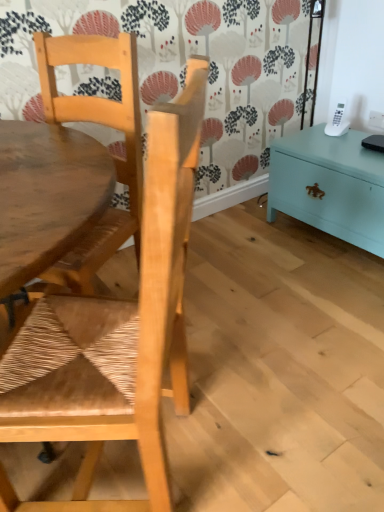
The height and width of the screenshot is (512, 384). What do you see at coordinates (330, 185) in the screenshot?
I see `teal painted wood chest at right` at bounding box center [330, 185].

You are a GUI agent. You are given a task and a screenshot of the screen. Output one action in this format:
    pyautogui.click(x=<x>, y=<y>)
    Task: Click on the natural wood chair at left, positioned as the 2th chair in top-to-bottom order
    Image resolution: width=384 pixels, height=512 pixels.
    Given the screenshot: What is the action you would take?
    pyautogui.click(x=114, y=333)

Is teal painted wood chest at right touching natural wood chair at left, the 1th chair ordered from the bottom?

No, teal painted wood chest at right is not making contact with natural wood chair at left, the 1th chair ordered from the bottom.

Which is more to the left, teal painted wood chest at right or natural wood chair at left, the 1th chair ordered from the bottom?

natural wood chair at left, the 1th chair ordered from the bottom, is more to the left.

From the image's perspective, is teal painted wood chest at right beneath natural wood chair at left, positioned as the 2th chair in top-to-bottom order?

No, from the image's perspective, teal painted wood chest at right is not below natural wood chair at left, positioned as the 2th chair in top-to-bottom order.

Is teal painted wood chest at right taller or shorter than natural wood chair at left, the 1th chair ordered from the bottom?

teal painted wood chest at right is shorter than natural wood chair at left, the 1th chair ordered from the bottom.

How many degrees apart are the facing directions of natural wood chair at left, the 1th chair ordered from the bottom, and white plastic power outlet at upper right?

The facing directions of natural wood chair at left, the 1th chair ordered from the bottom, and white plastic power outlet at upper right are 43 degrees apart.

Which object is positioned more to the right, natural wood chair at left, the 1th chair ordered from the bottom, or white plastic power outlet at upper right?

Positioned to the right is white plastic power outlet at upper right.

Locate an element on the screen. the 2nd chair in front of the white plastic power outlet at upper right is located at coordinates (114, 333).

Considering the sizes of objects natural wood chair at left, the 1th chair ordered from the bottom, and white plastic power outlet at upper right in the image provided, who is wider, natural wood chair at left, the 1th chair ordered from the bottom, or white plastic power outlet at upper right?

natural wood chair at left, the 1th chair ordered from the bottom.

Identify the location of chair that is the 1st object located in front of the teal painted wood chest at right. (112, 153).

Is point (373, 205) closer or farther from the camera than point (71, 56)?

Point (373, 205) appears to be farther away from the viewer than point (71, 56).

Can you tell me how much teal painted wood chest at right and natural wood chair at upper left, the second chair positioned from the bottom, differ in facing direction?

26 degrees separate the facing orientations of teal painted wood chest at right and natural wood chair at upper left, the second chair positioned from the bottom.

Considering the sizes of objects natural wood chair at upper left, the second chair positioned from the bottom, and natural wood chair at left, positioned as the 2th chair in top-to-bottom order, in the image provided, who is taller, natural wood chair at upper left, the second chair positioned from the bottom, or natural wood chair at left, positioned as the 2th chair in top-to-bottom order,?

natural wood chair at left, positioned as the 2th chair in top-to-bottom order.

Who is bigger, natural wood chair at upper left, the first chair when ordered from top to bottom, or natural wood chair at left, positioned as the 2th chair in top-to-bottom order?

natural wood chair at left, positioned as the 2th chair in top-to-bottom order, is bigger.

Is natural wood chair at upper left, the first chair when ordered from top to bottom, directly adjacent to natural wood chair at left, positioned as the 2th chair in top-to-bottom order?

There is a gap between natural wood chair at upper left, the first chair when ordered from top to bottom, and natural wood chair at left, positioned as the 2th chair in top-to-bottom order.

Would you say natural wood chair at upper left, the second chair positioned from the bottom, is to the left or to the right of natural wood chair at left, positioned as the 2th chair in top-to-bottom order, in the picture?

In the image, natural wood chair at upper left, the second chair positioned from the bottom, appears on the left side of natural wood chair at left, positioned as the 2th chair in top-to-bottom order.

Is white plastic power outlet at upper right not close to teal painted wood chest at right?

white plastic power outlet at upper right is actually quite close to teal painted wood chest at right.

How many degrees apart are the facing directions of white plastic power outlet at upper right and teal painted wood chest at right?

2.17 degrees.

Considering the points (372, 115) and (282, 140), which point is behind, point (372, 115) or point (282, 140)?

The point (372, 115) is farther from the camera.

Who is taller, white plastic power outlet at upper right or teal painted wood chest at right?

With more height is teal painted wood chest at right.

From the picture: Would you say natural wood chair at upper left, the second chair positioned from the bottom, is outside teal painted wood chest at right?

natural wood chair at upper left, the second chair positioned from the bottom, lies outside teal painted wood chest at right's area.

From a real-world perspective, is natural wood chair at upper left, the first chair when ordered from top to bottom, positioned under teal painted wood chest at right based on gravity?

No, from a real-world perspective, natural wood chair at upper left, the first chair when ordered from top to bottom, is not under teal painted wood chest at right.

How distant is natural wood chair at upper left, the first chair when ordered from top to bottom, from teal painted wood chest at right?

The distance of natural wood chair at upper left, the first chair when ordered from top to bottom, from teal painted wood chest at right is 97.93 centimeters.

Is teal painted wood chest at right facing away from white plastic power outlet at upper right?

Yes, teal painted wood chest at right is facing away from white plastic power outlet at upper right.

Does teal painted wood chest at right appear on the right side of white plastic power outlet at upper right?

No.

Is teal painted wood chest at right taller than white plastic power outlet at upper right?

Correct, teal painted wood chest at right is much taller as white plastic power outlet at upper right.

From the picture: Considering the positions of objects teal painted wood chest at right and white plastic power outlet at upper right in the image provided, who is in front, teal painted wood chest at right or white plastic power outlet at upper right?

teal painted wood chest at right is closer to the camera.

The height and width of the screenshot is (512, 384). In order to click on chair that is the 1st object above the teal painted wood chest at right (from a real-world perspective) in this screenshot , I will do `click(114, 333)`.

Which chair is the 2nd one when counting from the front of the white plastic power outlet at upper right? Please provide its 2D coordinates.

[(114, 333)]

From the image, which object appears to be farther from teal painted wood chest at right, white plastic power outlet at upper right or natural wood chair at upper left, the first chair when ordered from top to bottom?

Among the two, natural wood chair at upper left, the first chair when ordered from top to bottom, is located further to teal painted wood chest at right.

Based on the photo, looking at the image, which one is located further to natural wood chair at upper left, the second chair positioned from the bottom, natural wood chair at left, the 1th chair ordered from the bottom, or white plastic power outlet at upper right?

Among the two, white plastic power outlet at upper right is located further to natural wood chair at upper left, the second chair positioned from the bottom.

Which object lies nearer to the anchor point natural wood chair at left, positioned as the 2th chair in top-to-bottom order, white plastic power outlet at upper right or teal painted wood chest at right?

teal painted wood chest at right.

Estimate the real-world distances between objects in this image. Which object is closer to teal painted wood chest at right, natural wood chair at left, positioned as the 2th chair in top-to-bottom order, or natural wood chair at upper left, the first chair when ordered from top to bottom?

natural wood chair at left, positioned as the 2th chair in top-to-bottom order.

Estimate the real-world distances between objects in this image. Which object is further from natural wood chair at upper left, the first chair when ordered from top to bottom, white plastic power outlet at upper right or teal painted wood chest at right?

white plastic power outlet at upper right is further to natural wood chair at upper left, the first chair when ordered from top to bottom.

Which object lies nearer to the anchor point white plastic power outlet at upper right, natural wood chair at upper left, the first chair when ordered from top to bottom, or natural wood chair at left, the 1th chair ordered from the bottom?

natural wood chair at upper left, the first chair when ordered from top to bottom, is closer to white plastic power outlet at upper right.

Considering their positions, is natural wood chair at left, the 1th chair ordered from the bottom, positioned closer to natural wood chair at upper left, the second chair positioned from the bottom, than teal painted wood chest at right?

The object closer to natural wood chair at upper left, the second chair positioned from the bottom, is natural wood chair at left, the 1th chair ordered from the bottom.

From the image, which object appears to be farther from natural wood chair at upper left, the first chair when ordered from top to bottom, teal painted wood chest at right or white plastic power outlet at upper right?

white plastic power outlet at upper right.

This screenshot has width=384, height=512. Identify the location of nightstand between natural wood chair at left, the 1th chair ordered from the bottom, and white plastic power outlet at upper right in the front-back direction. (330, 185).

This screenshot has height=512, width=384. What are the coordinates of `chair located between natural wood chair at left, the 1th chair ordered from the bottom, and white plastic power outlet at upper right in the depth direction` in the screenshot? It's located at (112, 153).

This screenshot has width=384, height=512. Find the location of `nightstand between natural wood chair at upper left, the first chair when ordered from top to bottom, and white plastic power outlet at upper right from left to right`. nightstand between natural wood chair at upper left, the first chair when ordered from top to bottom, and white plastic power outlet at upper right from left to right is located at coordinates (330, 185).

Identify the location of chair situated between natural wood chair at upper left, the first chair when ordered from top to bottom, and teal painted wood chest at right from left to right. The height and width of the screenshot is (512, 384). point(114,333).